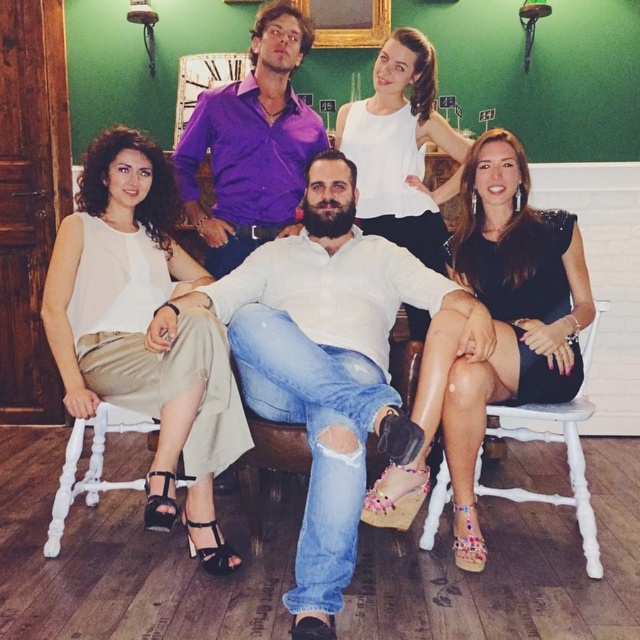
Question: Does white cotton shirt at center have a greater width compared to white matte top at upper center?

Choices:
 (A) no
 (B) yes

Answer: (B)

Question: Is black satin dress at lower right to the left of white matte top at upper center from the viewer's perspective?

Choices:
 (A) no
 (B) yes

Answer: (A)

Question: From the image, what is the correct spatial relationship of black leather sandal at lower left in relation to ripped denim jeans at center?

Choices:
 (A) below
 (B) above

Answer: (A)

Question: Which of the following is the farthest from the observer?

Choices:
 (A) (403, 369)
 (B) (230, 570)

Answer: (A)

Question: Among these points, which one is farthest from the camera?

Choices:
 (A) (401, 380)
 (B) (225, 554)
 (C) (236, 100)

Answer: (C)

Question: Which of the following is the closest to the observer?

Choices:
 (A) (460, 524)
 (B) (168, 524)
 (C) (161, 284)

Answer: (B)